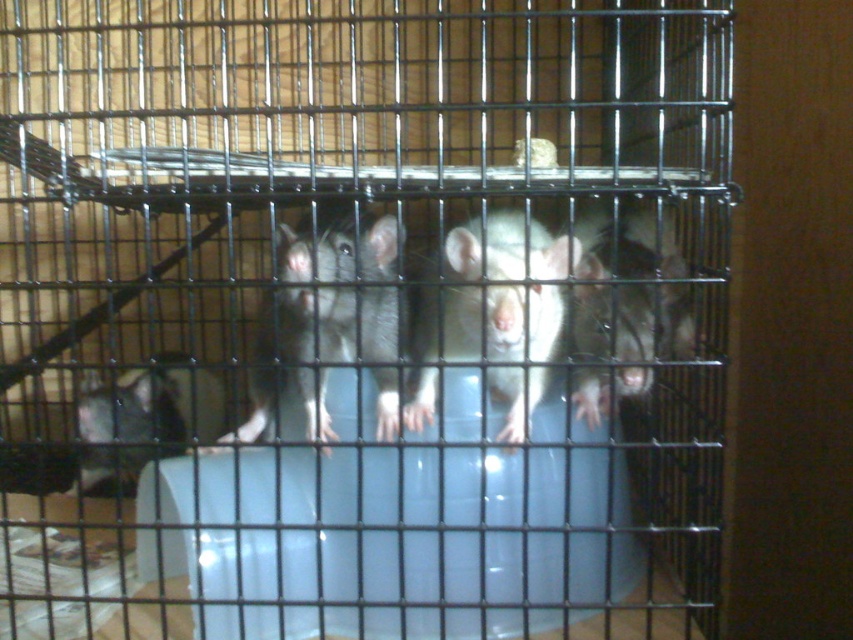
You are observing the rats in the metal cage and want to determine which of the two points, point [241,442] or point [456,348], is nearer to you. Based on the scene, which point is closer?

Point [241,442] is closer to the camera than point [456,348], so it is the nearer one.

In the image of the cage with rats, where is the white matte rat at center relative to the matte gray mouse at lower left?

The white matte rat at center is to the right of the matte gray mouse at lower left.